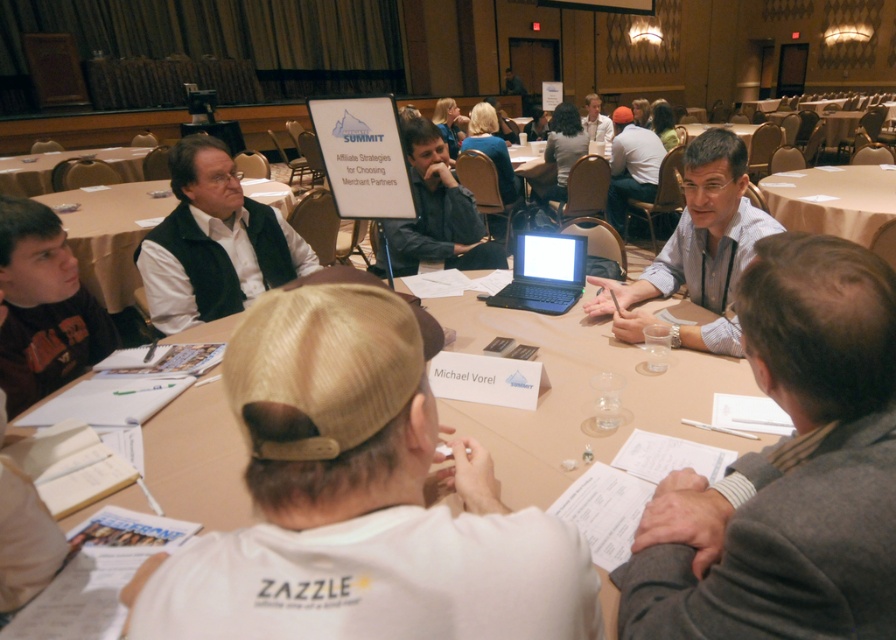
You are organizing a meeting and need to place a 1.2 meter wide banner between the black matte vest at upper left and the matte white table at center. Can the banner fit between them based on their widths?

The black matte vest at upper left is narrower than the matte white table at center. However, the banner requires 1.2 meters of space, but the description only provides information about their widths relative to each other, not their actual measurements. Without knowing the exact width of either object, it is impossible to determine if the banner will fit.

You are a service robot with a height of 5.5 feet. You need to deliver a document to the person wearing the black matte vest at upper left. The document is on the matte white table at center. Can you reach the document without needing to climb onto the table?

The distance between the black matte vest at upper left and the matte white table at center is 4.67 feet. Since the robot is 5.5 feet tall, it can easily reach the document on the table without climbing onto it as the table is within its reach height.